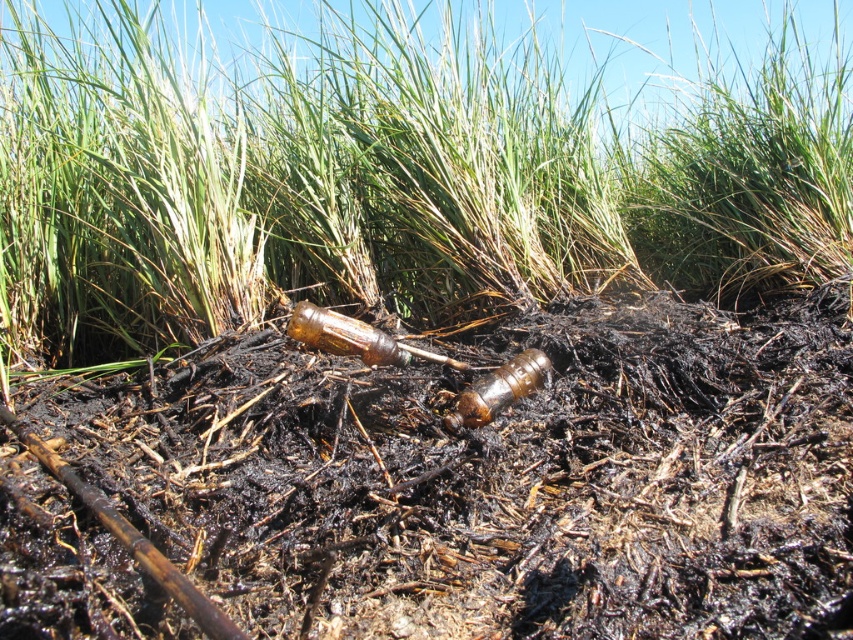
You are a gardener trying to plant a new shrub between the brown charred dirt at center and the green grass at center. What is the minimum distance you need to maintain between the shrub and each of these two areas to ensure proper growth?

The brown charred dirt at center and green grass at center are 1.63 meters apart from each other. To ensure proper growth, the shrub should be placed centrally between them, maintaining at least 0.815 meters distance from each area.

Consider the image. You are a hiker who has just found a spot to set up camp. You notice the brown charred dirt at center in your current location. Based on its position at point coordinates, would you consider this area safe for setting up your tent?

The brown charred dirt at center is located at coordinates point (498, 477), which indicates it is in the central area of the scene. Charred dirt often signifies past fire activity, so setting up a tent here may not be safe due to potential fire hazards or unstable ground. Choose a different location away from the brown charred dirt at center.